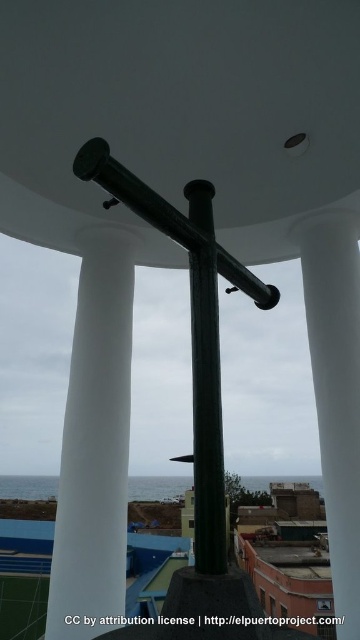
Question: Which object is positioned closest to the white smooth pillar at center?

Choices:
 (A) glossy metal pole at center
 (B) matte black beam at center
 (C) white smooth column at left

Answer: (C)

Question: Which point appears farthest from the camera in this image?

Choices:
 (A) (208, 294)
 (B) (231, 282)
 (C) (349, 625)

Answer: (C)

Question: In this image, where is white smooth column at left located relative to white smooth pillar at center?

Choices:
 (A) above
 (B) below

Answer: (B)

Question: Does white smooth column at left have a smaller size compared to white smooth pillar at center?

Choices:
 (A) yes
 (B) no

Answer: (B)

Question: In this image, where is white smooth column at left located relative to glossy metal pole at center?

Choices:
 (A) right
 (B) left

Answer: (B)

Question: Which point is closer to the camera taking this photo?

Choices:
 (A) (118, 593)
 (B) (146, 205)
 (C) (349, 536)
 (D) (201, 461)

Answer: (D)